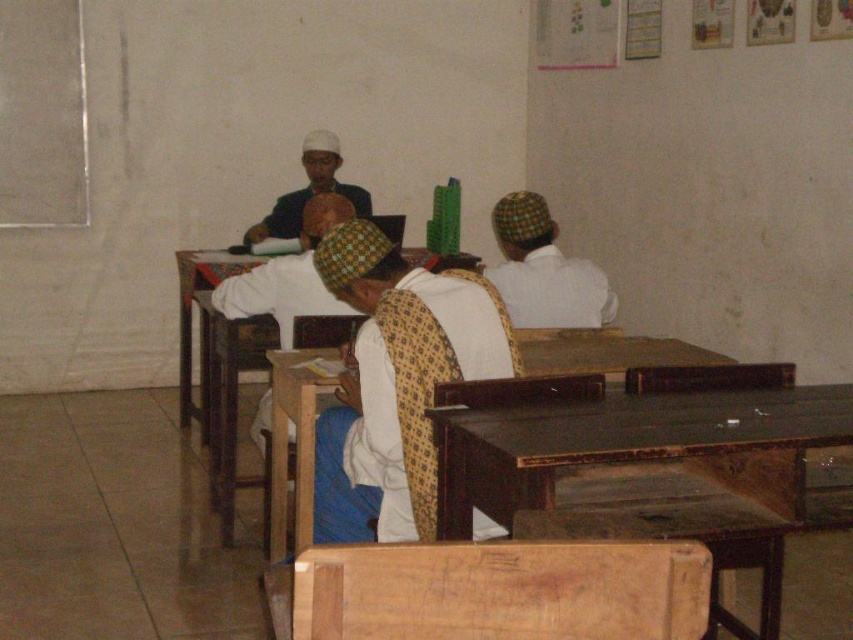
Question: Which object appears farthest from the camera in this image?

Choices:
 (A) white cloth at upper center
 (B) dark brown wooden table at center
 (C) white cotton shirt at center

Answer: (A)

Question: From the image, what is the correct spatial relationship of white cotton shirt at center in relation to matte black shirt at center?

Choices:
 (A) left
 (B) right

Answer: (B)

Question: Observing the image, what is the correct spatial positioning of dark brown wooden table at center in reference to white cloth at upper center?

Choices:
 (A) above
 (B) below

Answer: (B)

Question: Which object appears farthest from the camera in this image?

Choices:
 (A) white cotton shirt at center
 (B) white cloth at upper center

Answer: (B)

Question: Which point is farther to the camera?

Choices:
 (A) white cotton shirt at center
 (B) dark brown wooden table at center
 (C) wooden table at center

Answer: (C)

Question: Is wooden table at center bigger than matte black shirt at center?

Choices:
 (A) no
 (B) yes

Answer: (B)